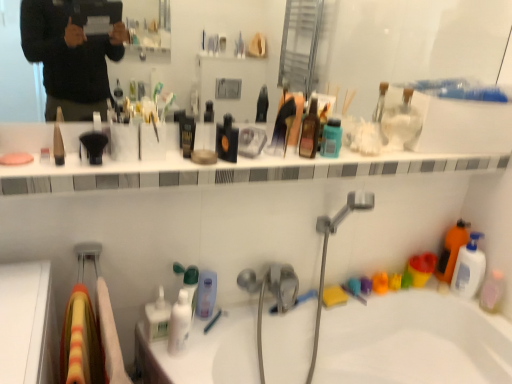
Find the location of a particular element. The image size is (512, 384). unoccupied region to the right of black glass bottle at center, the 5th toiletry from the left is located at coordinates (270, 163).